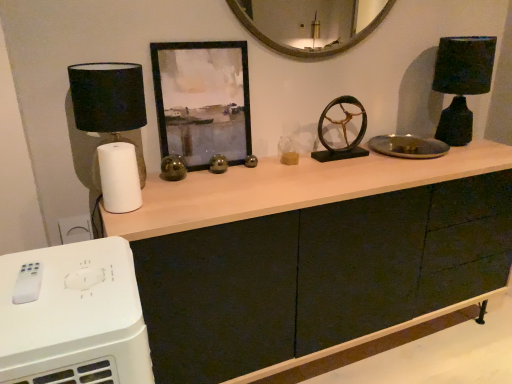
Question: Are black matte picture frame at center and matte black cabinet at center located far from each other?

Choices:
 (A) no
 (B) yes

Answer: (A)

Question: From a real-world perspective, is black matte picture frame at center positioned under matte black cabinet at center based on gravity?

Choices:
 (A) no
 (B) yes

Answer: (A)

Question: Considering the relative sizes of black matte picture frame at center and matte black cabinet at center in the image provided, is black matte picture frame at center thinner than matte black cabinet at center?

Choices:
 (A) yes
 (B) no

Answer: (A)

Question: Is black matte picture frame at center facing away from matte black cabinet at center?

Choices:
 (A) yes
 (B) no

Answer: (B)

Question: From a real-world perspective, is black matte picture frame at center positioned over matte black cabinet at center based on gravity?

Choices:
 (A) no
 (B) yes

Answer: (B)

Question: Does point (151, 49) appear closer or farther from the camera than point (350, 148)?

Choices:
 (A) closer
 (B) farther

Answer: (A)

Question: Is black matte picture frame at center taller or shorter than bronze metallic wheel at center?

Choices:
 (A) short
 (B) tall

Answer: (B)

Question: Looking at their shapes, would you say black matte picture frame at center is wider or thinner than bronze metallic wheel at center?

Choices:
 (A) wide
 (B) thin

Answer: (B)

Question: From a real-world perspective, is black matte picture frame at center positioned above or below bronze metallic wheel at center?

Choices:
 (A) below
 (B) above

Answer: (B)

Question: From a real-world perspective, relative to white plastic remote control at lower left, is matte black lampshade at left, positioned as the 2th table lamp in right-to-left order, vertically above or below?

Choices:
 (A) below
 (B) above

Answer: (B)

Question: From the image's perspective, relative to white plastic remote control at lower left, is matte black lampshade at left, which appears as the 1th table lamp when viewed from the front, above or below?

Choices:
 (A) above
 (B) below

Answer: (A)

Question: In the image, is matte black lampshade at left, positioned as the 2th table lamp in right-to-left order, on the left side or the right side of white plastic remote control at lower left?

Choices:
 (A) right
 (B) left

Answer: (B)

Question: Which is correct: matte black lampshade at left, which appears as the 1th table lamp when viewed from the front, is inside white plastic remote control at lower left, or outside of it?

Choices:
 (A) inside
 (B) outside

Answer: (B)

Question: Considering the positions of matte black lampshade at left, which is counted as the 1th table lamp, starting from the left, and matte black lampshade at right, which is the second table lamp from front to back, in the image, is matte black lampshade at left, which is counted as the 1th table lamp, starting from the left, taller or shorter than matte black lampshade at right, which is the second table lamp from front to back,?

Choices:
 (A) short
 (B) tall

Answer: (A)

Question: Which is correct: matte black lampshade at left, the 2th table lamp in the back-to-front sequence, is inside matte black lampshade at right, arranged as the 2th table lamp when viewed from the left, or outside of it?

Choices:
 (A) inside
 (B) outside

Answer: (B)